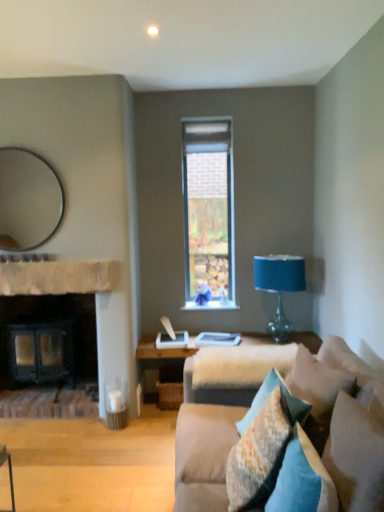
I want to click on vacant space situated above brown stone fireplace at left (from a real-world perspective), so (x=59, y=259).